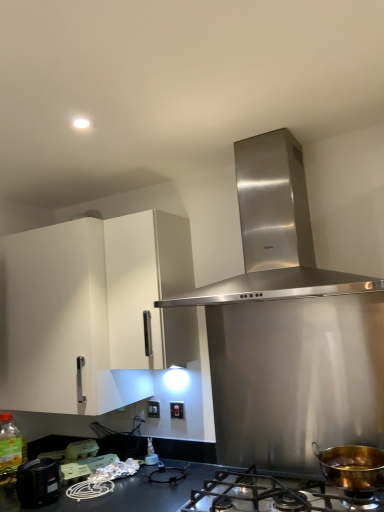
What do you see at coordinates (352, 467) in the screenshot? I see `gold-bronze pot at lower right` at bounding box center [352, 467].

Measure the distance between gold-bronze pot at lower right and camera.

4.84 feet.

Locate an element on the screen. The width and height of the screenshot is (384, 512). translucent plastic bottle at lower left, the first bottle when ordered from left to right is located at coordinates (10, 450).

In order to click on stainless steel gas stove at lower center in this screenshot , I will do `click(277, 494)`.

What is the approximate width of white plastic eggs at lower left, positioned as the 3th appliance in front-to-back order?

It is 3.52 inches.

The height and width of the screenshot is (512, 384). What are the coordinates of `gold-bronze pot at lower right` in the screenshot? It's located at (352, 467).

Which of these two, matte black switch at center, the 2th electric outlet from the left, or black plastic container at lower left, acting as the 3th appliance starting from the back, is smaller?

matte black switch at center, the 2th electric outlet from the left, is smaller.

Is matte black switch at center, the 2th electric outlet from the left, positioned before black plastic container at lower left, acting as the 3th appliance starting from the back?

No, matte black switch at center, the 2th electric outlet from the left, is further to the viewer.

From a real-world perspective, which is physically above, matte black switch at center, the 2th electric outlet viewed from the back, or black plastic container at lower left, which is the first appliance in front-to-back order?

matte black switch at center, the 2th electric outlet viewed from the back, from a real-world perspective.

Is matte black switch at center, the 2th electric outlet from the left, inside the boundaries of black plastic container at lower left, which is the first appliance in front-to-back order, or outside?

matte black switch at center, the 2th electric outlet from the left, is not enclosed by black plastic container at lower left, which is the first appliance in front-to-back order.

Would you say stainless steel gas stove at lower center is outside matte black switch at center, which ranks as the first electric outlet in right-to-left order?

→ stainless steel gas stove at lower center lies outside matte black switch at center, which ranks as the first electric outlet in right-to-left order,'s area.

Is stainless steel gas stove at lower center to the left of matte black switch at center, which ranks as the first electric outlet in right-to-left order, from the viewer's perspective?

In fact, stainless steel gas stove at lower center is to the right of matte black switch at center, which ranks as the first electric outlet in right-to-left order.

Which is in front, matte black switch at center, which ranks as the first electric outlet in right-to-left order, or stainless steel gas stove at lower center?

stainless steel gas stove at lower center is in front.

Does matte black switch at center, the 2th electric outlet from the left, turn towards stainless steel gas stove at lower center?

No, matte black switch at center, the 2th electric outlet from the left, is not oriented towards stainless steel gas stove at lower center.

From the image's perspective, which one is positioned lower, matte black switch at center, the 2th electric outlet from the left, or stainless steel gas stove at lower center?

Answer: From the image's view, stainless steel gas stove at lower center is below.

Is matte black switch at center, the 2th electric outlet from the left, shorter than stainless steel gas stove at lower center?

Correct, matte black switch at center, the 2th electric outlet from the left, is not as tall as stainless steel gas stove at lower center.

Is gold-bronze pot at lower right to the left or to the right of translucent plastic bottle at center, the second bottle viewed from the left, in the image?

Based on their positions, gold-bronze pot at lower right is located to the right of translucent plastic bottle at center, the second bottle viewed from the left.

From a real-world perspective, which is physically below, gold-bronze pot at lower right or translucent plastic bottle at center, the second bottle viewed from the left?

From a 3D spatial view, translucent plastic bottle at center, the second bottle viewed from the left, is below.

From the image's perspective, is gold-bronze pot at lower right positioned above or below translucent plastic bottle at center, the second bottle viewed from the left?

Clearly, from the image's perspective, gold-bronze pot at lower right is above translucent plastic bottle at center, the second bottle viewed from the left.

Considering the relative sizes of matte plastic container at lower left, acting as the second appliance starting from the front, and translucent plastic bottle at center, the second bottle viewed from the left, in the image provided, is matte plastic container at lower left, acting as the second appliance starting from the front, thinner than translucent plastic bottle at center, the second bottle viewed from the left,?

No, matte plastic container at lower left, acting as the second appliance starting from the front, is not thinner than translucent plastic bottle at center, the second bottle viewed from the left.

Does matte plastic container at lower left, acting as the second appliance starting from the front, turn towards translucent plastic bottle at center, the second bottle viewed from the left?

No, matte plastic container at lower left, acting as the second appliance starting from the front, is not oriented towards translucent plastic bottle at center, the second bottle viewed from the left.

Can you tell me how much matte plastic container at lower left, which is the second appliance from back to front, and translucent plastic bottle at center, the second bottle viewed from the left, differ in facing direction?

There is a 58.7-degree angle between the facing directions of matte plastic container at lower left, which is the second appliance from back to front, and translucent plastic bottle at center, the second bottle viewed from the left.

Which object is more forward, matte plastic container at lower left, acting as the second appliance starting from the front, or translucent plastic bottle at center, the second bottle viewed from the left?

matte plastic container at lower left, acting as the second appliance starting from the front, is more forward.

Is white matte cabinet at upper left situated inside black plastic container at lower left, acting as the 3th appliance starting from the back, or outside?

white matte cabinet at upper left is outside black plastic container at lower left, acting as the 3th appliance starting from the back.

Based on the photo, is the position of white matte cabinet at upper left less distant than that of black plastic container at lower left, which is the first appliance in front-to-back order?

No, it is behind black plastic container at lower left, which is the first appliance in front-to-back order.

Consider the image. From the image's perspective, relative to black plastic container at lower left, acting as the 3th appliance starting from the back, is white matte cabinet at upper left above or below?

white matte cabinet at upper left is above black plastic container at lower left, acting as the 3th appliance starting from the back.

Is gold-bronze pot at lower right positioned with its back to white matte cabinet at upper left?

No, gold-bronze pot at lower right's orientation is not away from white matte cabinet at upper left.

Is gold-bronze pot at lower right completely or partially outside of white matte cabinet at upper left?

gold-bronze pot at lower right lies outside white matte cabinet at upper left's area.

In the image, is gold-bronze pot at lower right positioned in front of or behind white matte cabinet at upper left?

gold-bronze pot at lower right is positioned closer to the viewer than white matte cabinet at upper left.

Does gold-bronze pot at lower right have a greater width compared to white matte cabinet at upper left?

In fact, gold-bronze pot at lower right might be narrower than white matte cabinet at upper left.

You are a GUI agent. You are given a task and a screenshot of the screen. Output one action in this format:
    pyautogui.click(x=<x>, y=<y>)
    Task: Click on the 2nd electric outlet above the black plastic container at lower left, which is the first appliance in front-to-back order (from the image's perspective)
    
    Given the screenshot: What is the action you would take?
    pyautogui.click(x=177, y=410)

Locate an element on the screen. This screenshot has width=384, height=512. gas stove below the matte black switch at center, which ranks as the first electric outlet in right-to-left order (from the image's perspective) is located at coordinates (277, 494).

When comparing their distances from matte plastic container at lower left, which is the second appliance from back to front, does stainless steel range hood at center or translucent plastic bottle at lower left, the first bottle when ordered from left to right, seem closer?

translucent plastic bottle at lower left, the first bottle when ordered from left to right, is positioned closer to the anchor matte plastic container at lower left, which is the second appliance from back to front.

Considering their positions, is translucent plastic bottle at center, the second bottle viewed from the left, positioned closer to gold-bronze pot at lower right than white matte cabinet at upper left?

translucent plastic bottle at center, the second bottle viewed from the left.

Which object lies further to the anchor point white plastic electric outlet at center, which appears as the 2th electric outlet when viewed from the right, gold-bronze pot at lower right or black plastic container at lower left, acting as the 3th appliance starting from the back?

gold-bronze pot at lower right lies further to white plastic electric outlet at center, which appears as the 2th electric outlet when viewed from the right, than the other object.

Which object lies nearer to the anchor point translucent plastic bottle at lower left, placed as the 2th bottle when sorted from right to left, white matte cabinet at upper left or white plastic eggs at lower left, positioned as the 3th appliance in front-to-back order?

white plastic eggs at lower left, positioned as the 3th appliance in front-to-back order, is positioned closer to the anchor translucent plastic bottle at lower left, placed as the 2th bottle when sorted from right to left.

When comparing their distances from matte black switch at center, the 2th electric outlet from the left, does translucent plastic bottle at lower left, the first bottle when ordered from left to right, or black plastic container at lower left, acting as the 3th appliance starting from the back, seem further?

translucent plastic bottle at lower left, the first bottle when ordered from left to right, is further to matte black switch at center, the 2th electric outlet from the left.

Looking at this image, considering their positions, is translucent plastic bottle at lower left, the first bottle when ordered from left to right, positioned further to gold-bronze pot at lower right than black plastic container at lower left, which is the first appliance in front-to-back order?

translucent plastic bottle at lower left, the first bottle when ordered from left to right, lies further to gold-bronze pot at lower right than the other object.

Which object lies nearer to the anchor point white plastic electric outlet at center, marked as the 1th electric outlet in a back-to-front arrangement, white plastic eggs at lower left, positioned as the 3th appliance in front-to-back order, or white matte cabinet at upper left?

white plastic eggs at lower left, positioned as the 3th appliance in front-to-back order, is closer to white plastic electric outlet at center, marked as the 1th electric outlet in a back-to-front arrangement.

Which object lies further to the anchor point white matte cabinet at upper left, gold-bronze pot at lower right or stainless steel gas stove at lower center?

gold-bronze pot at lower right is further to white matte cabinet at upper left.

You are a GUI agent. You are given a task and a screenshot of the screen. Output one action in this format:
    pyautogui.click(x=<x>, y=<y>)
    Task: Click on the gas stove located between translucent plastic bottle at lower left, placed as the 2th bottle when sorted from right to left, and gold-bronze pot at lower right in the left-right direction
    The height and width of the screenshot is (512, 384).
    Given the screenshot: What is the action you would take?
    pyautogui.click(x=277, y=494)

The height and width of the screenshot is (512, 384). Find the location of `cabinetry that lies between stainless steel range hood at center and black plastic container at lower left, acting as the 3th appliance starting from the back, from top to bottom`. cabinetry that lies between stainless steel range hood at center and black plastic container at lower left, acting as the 3th appliance starting from the back, from top to bottom is located at coordinates (53, 317).

This screenshot has width=384, height=512. What are the coordinates of `cabinetry located between stainless steel gas stove at lower center and matte black switch at center, which ranks as the first electric outlet in right-to-left order, in the depth direction` in the screenshot? It's located at (53, 317).

At what (x,y) coordinates should I click in order to perform the action: click on kitchen appliance between stainless steel range hood at center and matte black switch at center, the 2th electric outlet from the left, vertically. Please return your answer as a coordinate pair (x, y). Looking at the image, I should click on (352, 467).